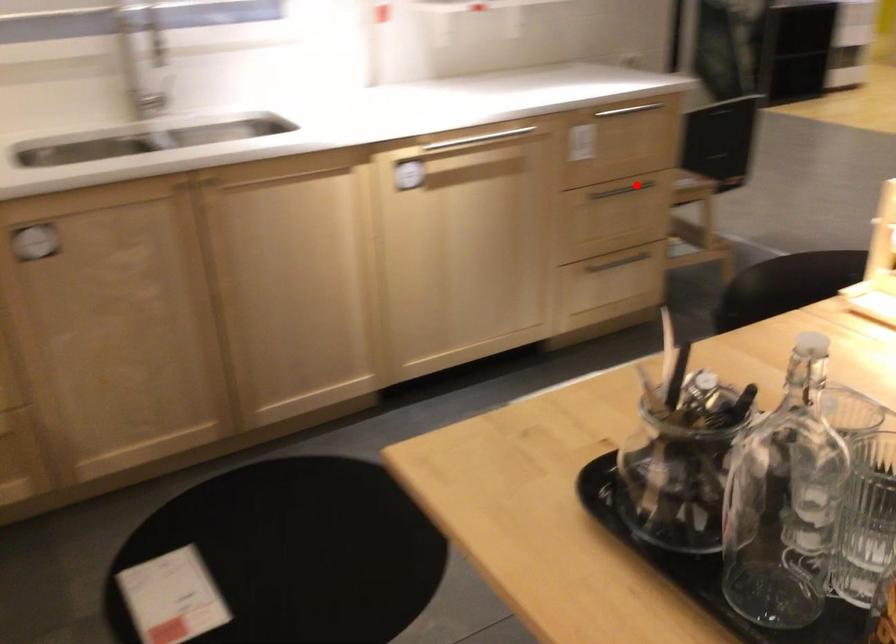
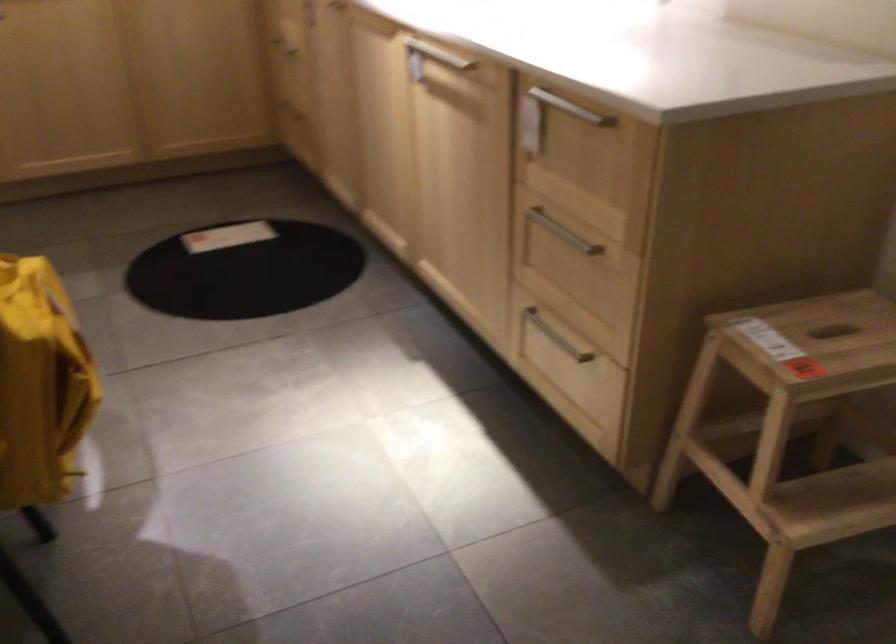
Question: A red point is marked in image1. In image2, is the corresponding 3D point closer to the camera or farther? Reply with the corresponding letter.

Choices:
 (A) The corresponding 3D point is closer.
 (B) The corresponding 3D point is farther.

Answer: (A)